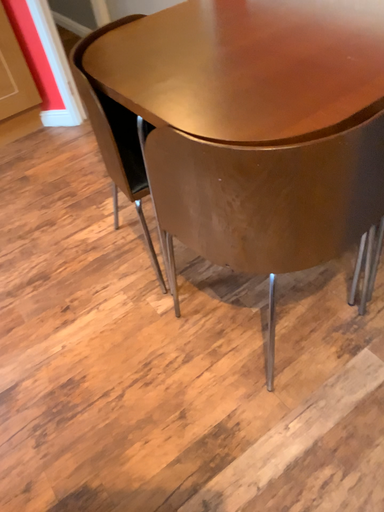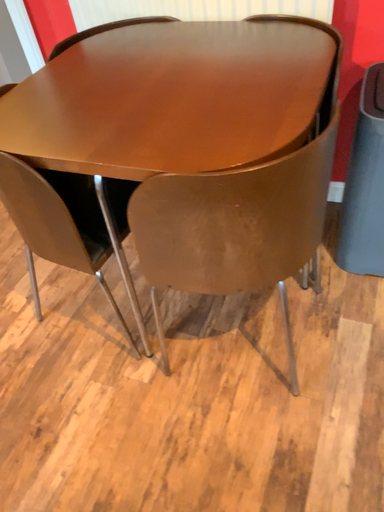
Question: Which way did the camera rotate in the video?

Choices:
 (A) rotated right
 (B) rotated left

Answer: (A)